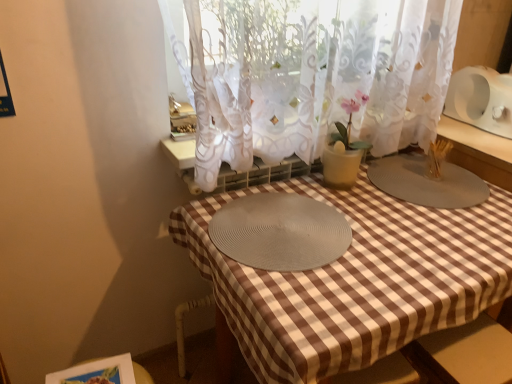
Question: Can you confirm if gray matte placemat at center, the first glass plate positioned from the right, is positioned to the left of white sheer curtain at center?

Choices:
 (A) yes
 (B) no

Answer: (B)

Question: Can you confirm if gray matte placemat at center, the first glass plate positioned from the right, is taller than white sheer curtain at center?

Choices:
 (A) yes
 (B) no

Answer: (B)

Question: Would you say gray matte placemat at center, which ranks as the second glass plate in left-to-right order, contains white sheer curtain at center?

Choices:
 (A) no
 (B) yes

Answer: (A)

Question: From a real-world perspective, is gray matte placemat at center, which ranks as the second glass plate in left-to-right order, located beneath white sheer curtain at center?

Choices:
 (A) yes
 (B) no

Answer: (A)

Question: Considering the relative positions of gray matte placemat at center, the first glass plate positioned from the right, and white sheer curtain at center in the image provided, is gray matte placemat at center, the first glass plate positioned from the right, behind white sheer curtain at center?

Choices:
 (A) no
 (B) yes

Answer: (B)

Question: Considering the relative sizes of gray matte placemat at center, which ranks as the second glass plate in left-to-right order, and white sheer curtain at center in the image provided, is gray matte placemat at center, which ranks as the second glass plate in left-to-right order, bigger than white sheer curtain at center?

Choices:
 (A) yes
 (B) no

Answer: (B)

Question: Can you confirm if white sheer curtain at center is smaller than gray woven placemat at center, placed as the second glass plate when sorted from right to left?

Choices:
 (A) no
 (B) yes

Answer: (A)

Question: Is white sheer curtain at center oriented away from gray woven placemat at center, positioned as the 1th glass plate in left-to-right order?

Choices:
 (A) no
 (B) yes

Answer: (A)

Question: From a real-world perspective, is white sheer curtain at center positioned under gray woven placemat at center, placed as the second glass plate when sorted from right to left, based on gravity?

Choices:
 (A) no
 (B) yes

Answer: (A)

Question: Is white sheer curtain at center touching gray woven placemat at center, placed as the second glass plate when sorted from right to left?

Choices:
 (A) no
 (B) yes

Answer: (A)

Question: Is white sheer curtain at center outside gray woven placemat at center, placed as the second glass plate when sorted from right to left?

Choices:
 (A) yes
 (B) no

Answer: (A)

Question: From a real-world perspective, is white sheer curtain at center on gray woven placemat at center, placed as the second glass plate when sorted from right to left?

Choices:
 (A) no
 (B) yes

Answer: (B)

Question: Can you confirm if gray woven placemat at center, positioned as the 1th glass plate in left-to-right order, is positioned to the left of white sheer curtain at center?

Choices:
 (A) no
 (B) yes

Answer: (B)